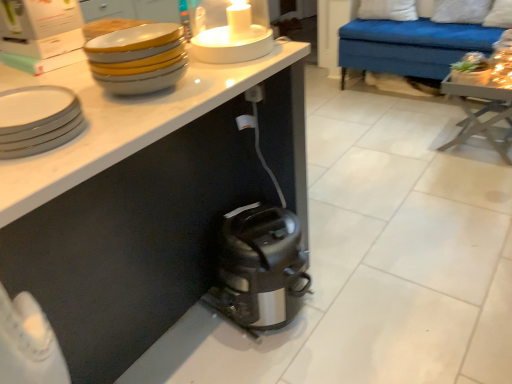
Question: Can you confirm if satin silver toaster at lower center is bigger than satin black toaster at lower center?

Choices:
 (A) yes
 (B) no

Answer: (B)

Question: From a real-world perspective, is satin silver toaster at lower center over satin black toaster at lower center?

Choices:
 (A) yes
 (B) no

Answer: (A)

Question: Does satin silver toaster at lower center lie behind satin black toaster at lower center?

Choices:
 (A) yes
 (B) no

Answer: (A)

Question: Is satin silver toaster at lower center turned away from satin black toaster at lower center?

Choices:
 (A) no
 (B) yes

Answer: (A)

Question: Is satin silver toaster at lower center in contact with satin black toaster at lower center?

Choices:
 (A) no
 (B) yes

Answer: (A)

Question: Is point 38,117 closer or farther from the camera than point 441,16?

Choices:
 (A) farther
 (B) closer

Answer: (B)

Question: Do you think white glossy plate at upper left, the 2th tableware when ordered from top to bottom, is within white soft pillow at upper right, placed as the 1th pillow when sorted from right to left, or outside of it?

Choices:
 (A) inside
 (B) outside

Answer: (B)

Question: From the image's perspective, relative to white soft pillow at upper right, which is the second pillow in left-to-right order, is white glossy plate at upper left, the 2th tableware when ordered from top to bottom, above or below?

Choices:
 (A) below
 (B) above

Answer: (A)

Question: From a real-world perspective, is white glossy plate at upper left, the 2th tableware when ordered from top to bottom, above or below white soft pillow at upper right, placed as the 1th pillow when sorted from right to left?

Choices:
 (A) below
 (B) above

Answer: (B)

Question: Is white glossy bowls at upper left, which is the second tableware in bottom-to-top order, inside or outside of satin silver toaster at lower center?

Choices:
 (A) inside
 (B) outside

Answer: (B)

Question: Is white glossy bowls at upper left, which is the second tableware in bottom-to-top order, in front of or behind satin silver toaster at lower center in the image?

Choices:
 (A) front
 (B) behind

Answer: (A)

Question: From the image's perspective, relative to satin silver toaster at lower center, is white glossy bowls at upper left, which is the 1th tableware from top to bottom, above or below?

Choices:
 (A) above
 (B) below

Answer: (A)

Question: Considering the positions of white glossy bowls at upper left, which is the 1th tableware from top to bottom, and satin silver toaster at lower center in the image, is white glossy bowls at upper left, which is the 1th tableware from top to bottom, wider or thinner than satin silver toaster at lower center?

Choices:
 (A) thin
 (B) wide

Answer: (A)

Question: In terms of height, does white glossy candle holder at upper center look taller or shorter compared to white glossy plate at upper left, positioned as the 1th tableware in bottom-to-top order?

Choices:
 (A) short
 (B) tall

Answer: (B)

Question: Relative to white glossy plate at upper left, the 2th tableware when ordered from top to bottom, is white glossy candle holder at upper center in front or behind?

Choices:
 (A) front
 (B) behind

Answer: (B)